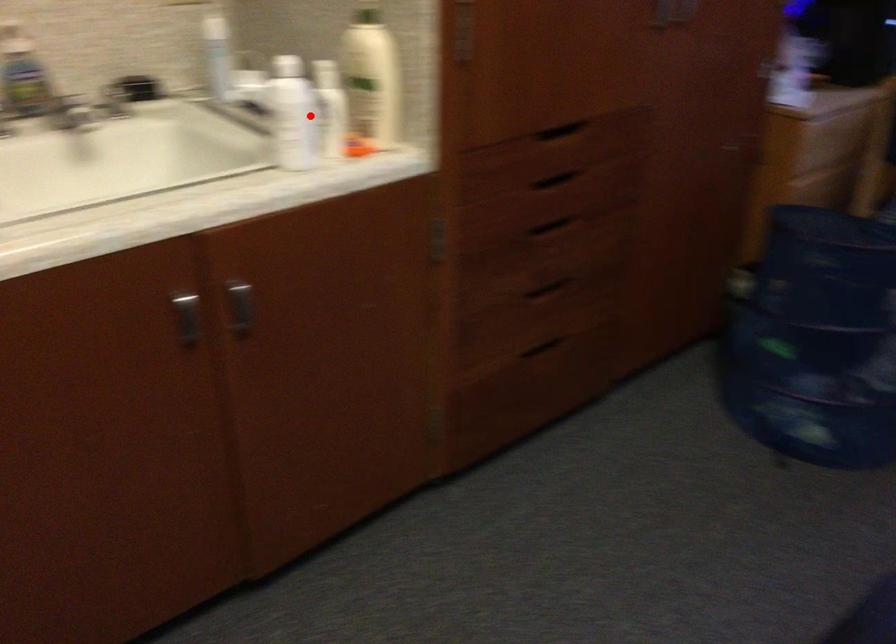
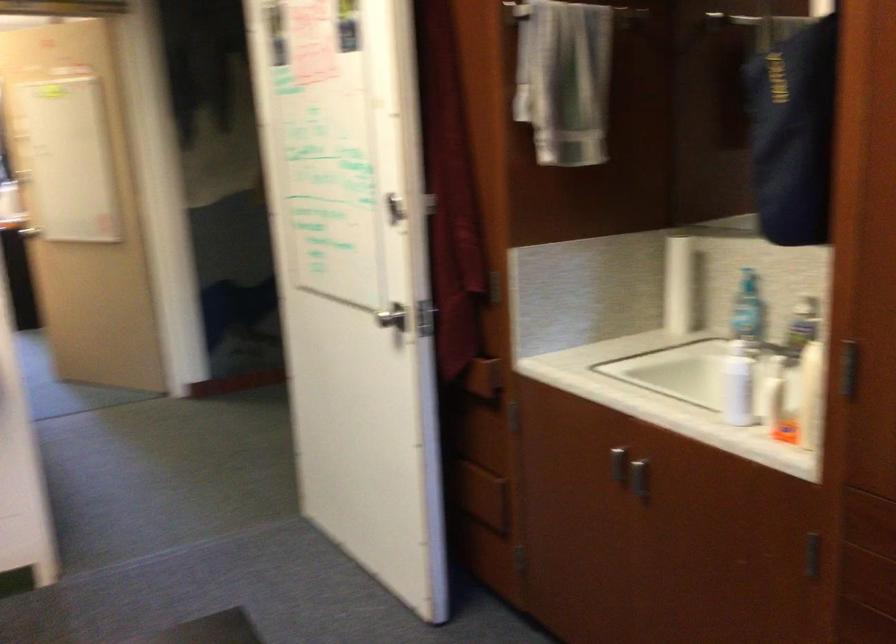
The point at the highlighted location is marked in the first image. Where is the corresponding point in the second image?

(737, 384)